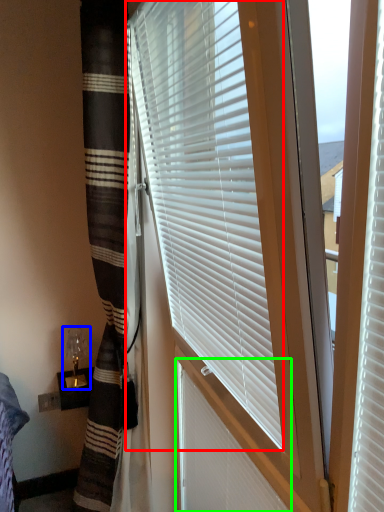
Question: Which object is positioned farthest from window blind (highlighted by a red box)? Select from table lamp (highlighted by a blue box) and shutter (highlighted by a green box).

Choices:
 (A) table lamp
 (B) shutter

Answer: (A)